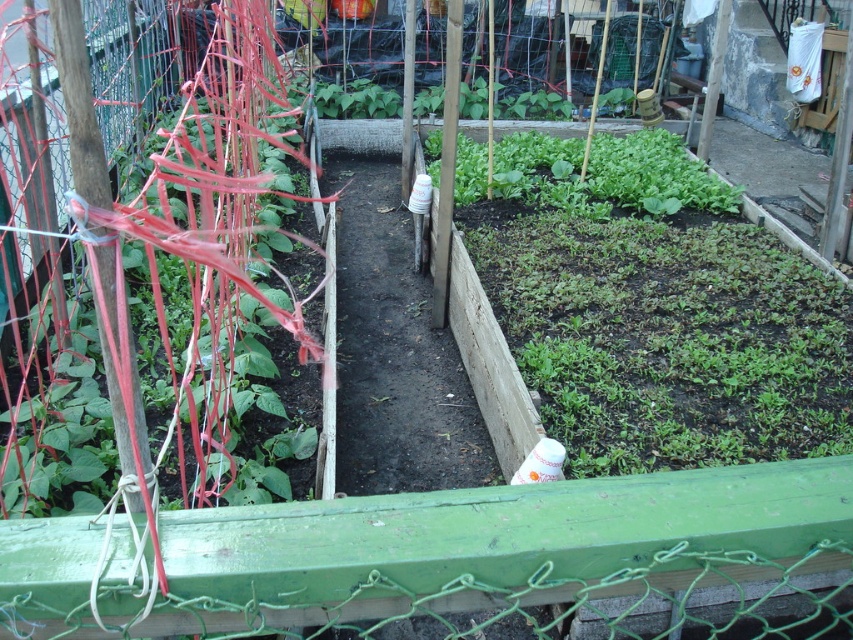
Question: Which point is farther to the camera?

Choices:
 (A) (328, 368)
 (B) (521, 157)

Answer: (B)

Question: Which point is farther to the camera?

Choices:
 (A) (498, 184)
 (B) (218, 452)

Answer: (A)

Question: Is the position of green matte plant at left more distant than that of green leafy at center?

Choices:
 (A) yes
 (B) no

Answer: (B)

Question: Can you confirm if green matte plant at left is smaller than green leafy at center?

Choices:
 (A) no
 (B) yes

Answer: (A)

Question: Considering the relative positions of green matte plant at left and green leafy at center in the image provided, where is green matte plant at left located with respect to green leafy at center?

Choices:
 (A) below
 (B) above

Answer: (A)

Question: Which point appears closest to the camera in this image?

Choices:
 (A) (587, 168)
 (B) (70, 408)

Answer: (B)